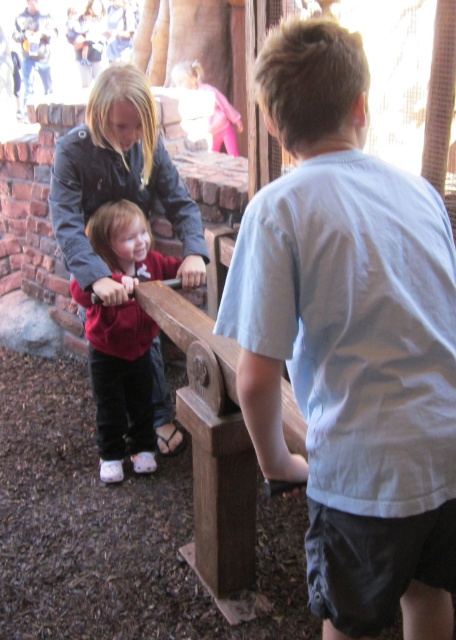
Does white cotton shirt at center appear on the left side of matte red shirt at center?

Incorrect, white cotton shirt at center is not on the left side of matte red shirt at center.

Who is positioned more to the left, white cotton shirt at center or matte red shirt at center?

Positioned to the left is matte red shirt at center.

The image size is (456, 640). I want to click on white cotton shirt at center, so click(350, 342).

Is point (153, 316) behind point (114, 422)?

No, it is not.

Between wooden park bench at center and matte red shirt at center, which one is positioned higher?

matte red shirt at center

I want to click on wooden park bench at center, so click(212, 449).

The image size is (456, 640). Identify the location of wooden park bench at center. (212, 449).

Who is shorter, white cotton shirt at center or wooden park bench at center?

wooden park bench at center is shorter.

From the picture: Who is higher up, white cotton shirt at center or wooden park bench at center?

white cotton shirt at center is above.

Does point (419, 268) come farther from viewer compared to point (190, 433)?

No, (419, 268) is in front of (190, 433).

At what (x,y) coordinates should I click in order to perform the action: click on white cotton shirt at center. Please return your answer as a coordinate pair (x, y). The image size is (456, 640). Looking at the image, I should click on (350, 342).